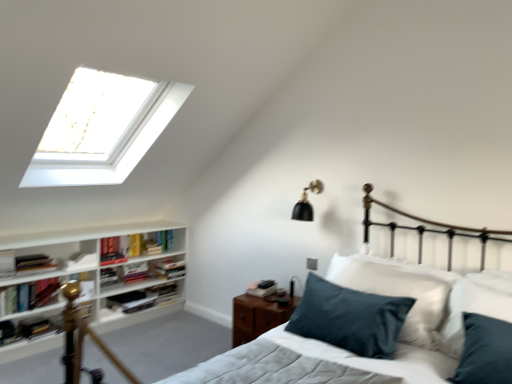
Question: Would you say black matte wall sconce at upper right contains hardcover book at left, marked as the 9th book in a top-to-bottom arrangement?

Choices:
 (A) yes
 (B) no

Answer: (B)

Question: From the image's perspective, is black matte wall sconce at upper right on top of hardcover book at left, marked as the 9th book in a top-to-bottom arrangement?

Choices:
 (A) no
 (B) yes

Answer: (B)

Question: Could you tell me if black matte wall sconce at upper right is turned towards hardcover book at left, which is counted as the first book, starting from the bottom?

Choices:
 (A) yes
 (B) no

Answer: (B)

Question: Does black matte wall sconce at upper right have a larger size compared to hardcover book at left, which is counted as the first book, starting from the bottom?

Choices:
 (A) no
 (B) yes

Answer: (B)

Question: Is black matte wall sconce at upper right smaller than hardcover book at left, which is counted as the first book, starting from the bottom?

Choices:
 (A) yes
 (B) no

Answer: (B)

Question: Is hardcover book at left, which appears as the sixth book when viewed from the top, taller or shorter than hardcover book at left, placed as the ninth book when sorted from bottom to top?

Choices:
 (A) tall
 (B) short

Answer: (B)

Question: Looking at their shapes, would you say hardcover book at left, which appears as the sixth book when viewed from the top, is wider or thinner than hardcover book at left, placed as the 1th book when sorted from top to bottom?

Choices:
 (A) wide
 (B) thin

Answer: (B)

Question: From the image's perspective, is hardcover book at left, the fourth book from the bottom, located above or below hardcover book at left, placed as the ninth book when sorted from bottom to top?

Choices:
 (A) below
 (B) above

Answer: (A)

Question: In the image, is hardcover book at left, which appears as the sixth book when viewed from the top, positioned in front of or behind hardcover book at left, placed as the 1th book when sorted from top to bottom?

Choices:
 (A) front
 (B) behind

Answer: (B)

Question: Is hardcover book at center-left, which is counted as the sixth book, starting from the bottom, in front of or behind hardcover book at left, the fourth book from the bottom, in the image?

Choices:
 (A) front
 (B) behind

Answer: (B)

Question: Considering the relative positions of hardcover book at center-left, which is counted as the sixth book, starting from the bottom, and hardcover book at left, which appears as the sixth book when viewed from the top, in the image provided, is hardcover book at center-left, which is counted as the sixth book, starting from the bottom, to the left or to the right of hardcover book at left, which appears as the sixth book when viewed from the top,?

Choices:
 (A) left
 (B) right

Answer: (B)

Question: Considering the positions of hardcover book at center-left, which is counted as the sixth book, starting from the bottom, and hardcover book at left, which appears as the sixth book when viewed from the top, in the image, is hardcover book at center-left, which is counted as the sixth book, starting from the bottom, taller or shorter than hardcover book at left, which appears as the sixth book when viewed from the top,?

Choices:
 (A) tall
 (B) short

Answer: (A)

Question: From the image's perspective, is hardcover book at center-left, which is counted as the sixth book, starting from the bottom, positioned above or below hardcover book at left, the fourth book from the bottom?

Choices:
 (A) below
 (B) above

Answer: (B)

Question: From the image's perspective, relative to hardcover book at upper left, which is the 5th book in bottom-to-top order, is hardcover book at center, placed as the 3th book when sorted from bottom to top, above or below?

Choices:
 (A) below
 (B) above

Answer: (A)

Question: Considering their positions, is hardcover book at center, the 7th book viewed from the top, located in front of or behind hardcover book at upper left, which is the 5th book from top to bottom?

Choices:
 (A) front
 (B) behind

Answer: (B)